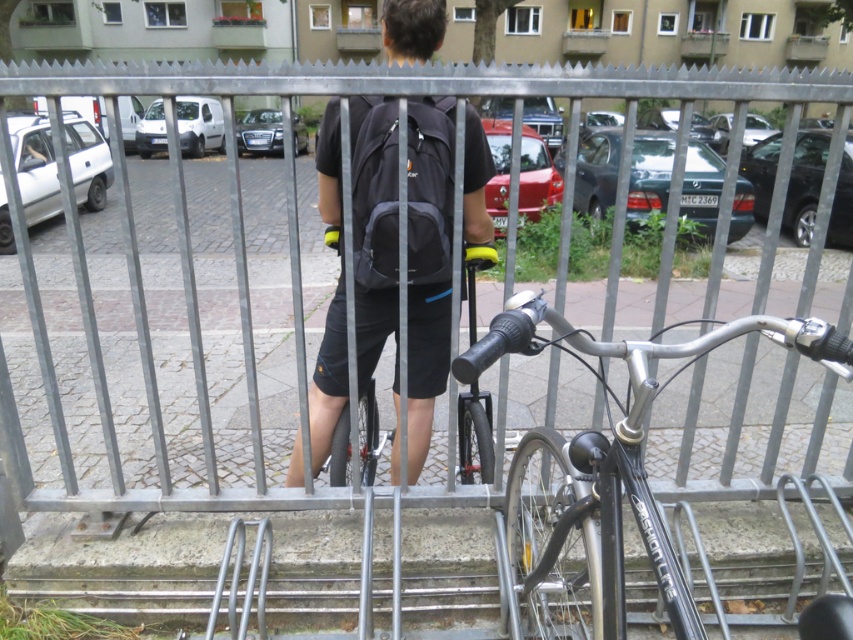
You are a security guard observing the scene. You notice the shiny metallic bicycle at center and the matte black backpack at center. According to the spatial arrangement, which object is closer to you?

The shiny metallic bicycle at center is closer to you because it is in front of the matte black backpack at center.

From the picture: You are a delivery person who needs to pass through the area between the metallic silver fence at center and the matte black backpack at center. Based on the scene, can you safely walk through this space without bending down?

The metallic silver fence at center is shorter than the matte black backpack at center. Since the fence is shorter, you can safely walk through the space without bending down as the fence height is lower than the backpack, which is likely positioned on the person.

You are a delivery person who needs to retrieve your shiny metallic bicycle at center from under the matte black backpack at center. Can you easily access it without moving the backpack?

The shiny metallic bicycle at center is positioned under the matte black backpack at center, so you cannot easily access it without moving the backpack.